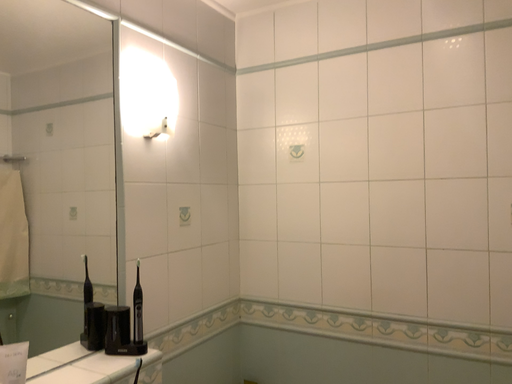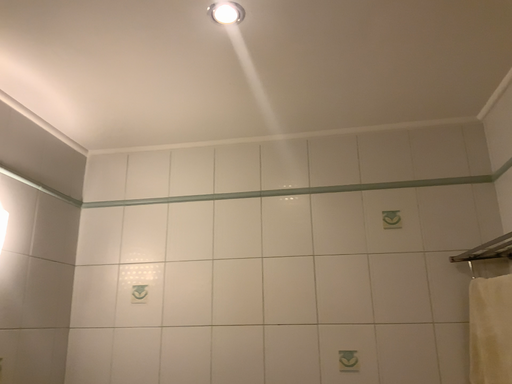
Question: How did the camera likely rotate when shooting the video?

Choices:
 (A) rotated downward
 (B) rotated upward

Answer: (B)